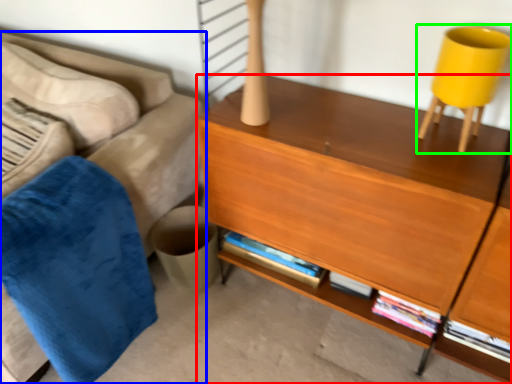
Question: Which object is the closest to the desk (highlighted by a red box)? Choose among these: studio couch (highlighted by a blue box) or swivel chair (highlighted by a green box).

Choices:
 (A) studio couch
 (B) swivel chair

Answer: (B)